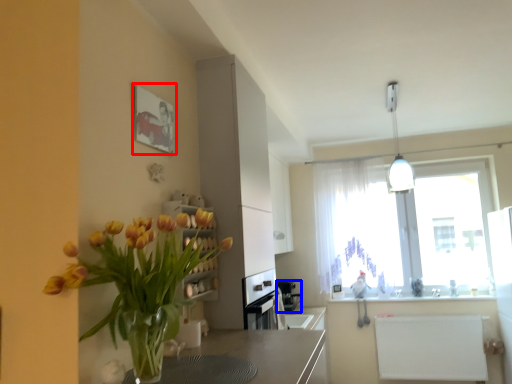
Question: Which object appears closest to the camera in this image, picture frame (highlighted by a red box) or appliance (highlighted by a blue box)?

Choices:
 (A) picture frame
 (B) appliance

Answer: (A)